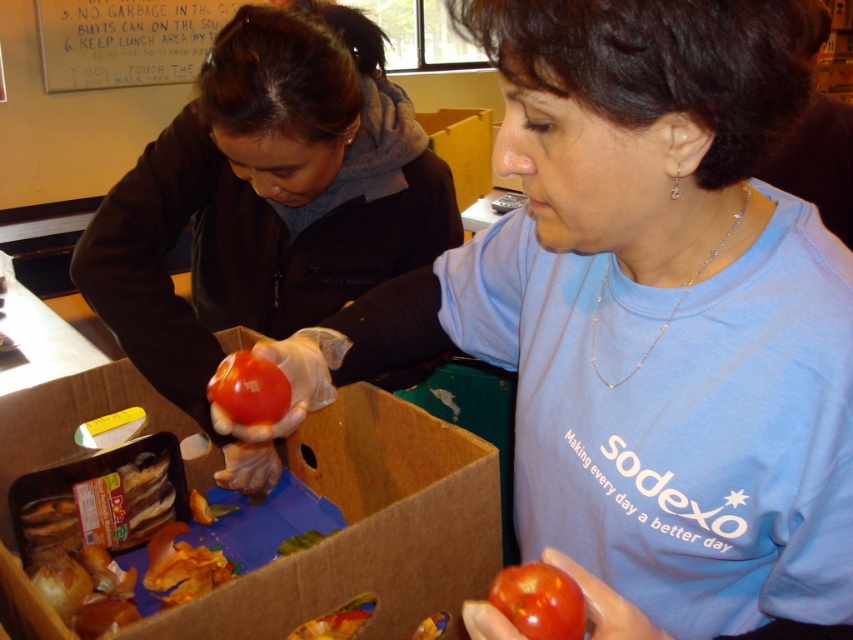
Question: Is matte black jacket at upper left bigger than glossy red tomato at lower center?

Choices:
 (A) yes
 (B) no

Answer: (A)

Question: Which object is farther from the camera taking this photo?

Choices:
 (A) glossy red tomato at center
 (B) white paperboard at upper left
 (C) brown cardboard box at center

Answer: (B)

Question: Among these points, which one is farthest from the camera?

Choices:
 (A) (228, 388)
 (B) (524, 579)
 (C) (80, 68)
 (D) (321, 269)

Answer: (C)

Question: Does glossy red tomato at lower center appear over glossy red tomato at center?

Choices:
 (A) yes
 (B) no

Answer: (B)

Question: Is white paperboard at upper left below glossy red tomato at center?

Choices:
 (A) yes
 (B) no

Answer: (B)

Question: Among these objects, which one is farthest from the camera?

Choices:
 (A) glossy red tomato at lower center
 (B) matte black jacket at upper left
 (C) glossy red tomato at center
 (D) brown cardboard box at center

Answer: (B)